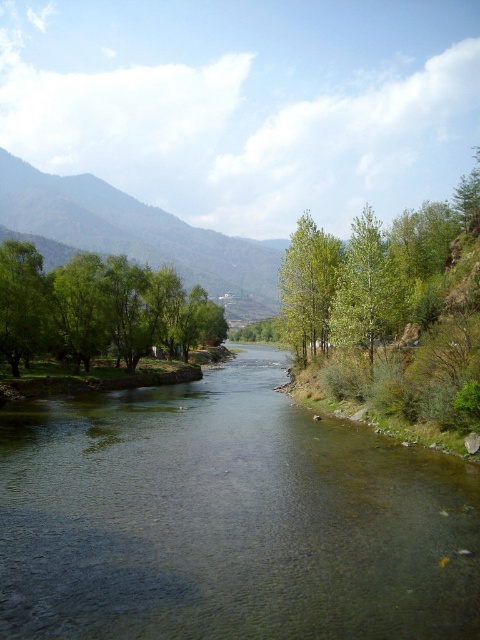
Question: Does green leafy trees at left appear under green leafy tree at right?

Choices:
 (A) no
 (B) yes

Answer: (B)

Question: Which point is farther to the camera?

Choices:
 (A) (40, 346)
 (B) (344, 305)
 (C) (165, 433)
 (D) (195, 262)

Answer: (D)

Question: Does clear water at center come behind green leafy tree at right?

Choices:
 (A) no
 (B) yes

Answer: (A)

Question: Which point is farther from the camera taking this photo?

Choices:
 (A) (117, 266)
 (B) (376, 540)
 (C) (363, 224)

Answer: (A)

Question: Which of these objects is positioned closest to the green leafy tree at right?

Choices:
 (A) green leafy tree at left
 (B) green leafy trees at left
 (C) green leafy mountain at upper left

Answer: (A)

Question: Is green leafy mountain at upper left to the right of green leafy tree at center from the viewer's perspective?

Choices:
 (A) no
 (B) yes

Answer: (A)